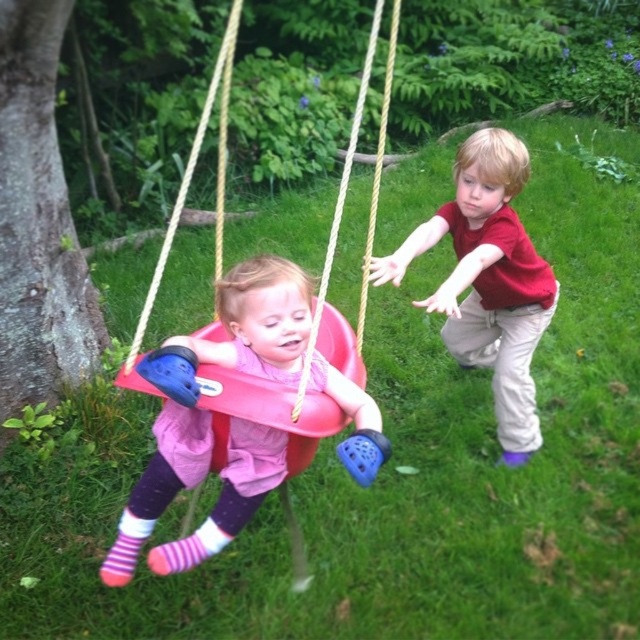
Question: Where is matte pink swing seat at center located in relation to smooth bark tree at left in the image?

Choices:
 (A) left
 (B) right

Answer: (B)

Question: Can you confirm if matte pink swing seat at center is wider than pink plastic swing at center?

Choices:
 (A) no
 (B) yes

Answer: (A)

Question: Which is farther from the matte red shirt at right?

Choices:
 (A) matte pink swing seat at center
 (B) smooth bark tree at left

Answer: (B)

Question: Estimate the real-world distances between objects in this image. Which object is closer to the matte red shirt at right?

Choices:
 (A) pink plastic swing at center
 (B) matte pink swing seat at center
 (C) smooth bark tree at left

Answer: (B)

Question: Which point appears closest to the camera in this image?

Choices:
 (A) (35, 280)
 (B) (496, 314)
 (C) (314, 317)

Answer: (C)

Question: Is smooth bark tree at left wider than matte red shirt at right?

Choices:
 (A) no
 (B) yes

Answer: (A)